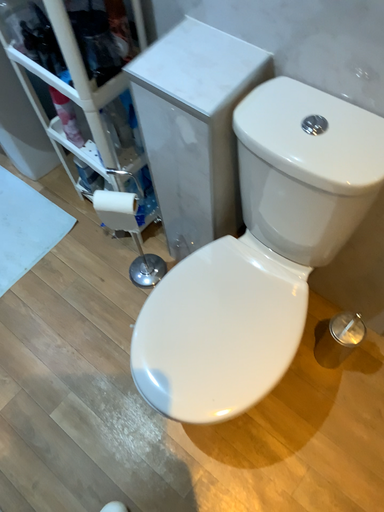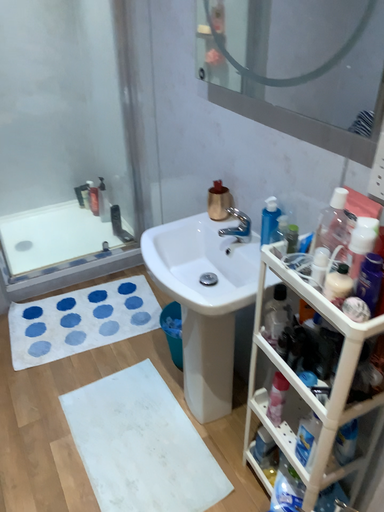
Question: How did the camera likely rotate when shooting the video?

Choices:
 (A) rotated downward
 (B) rotated upward

Answer: (B)